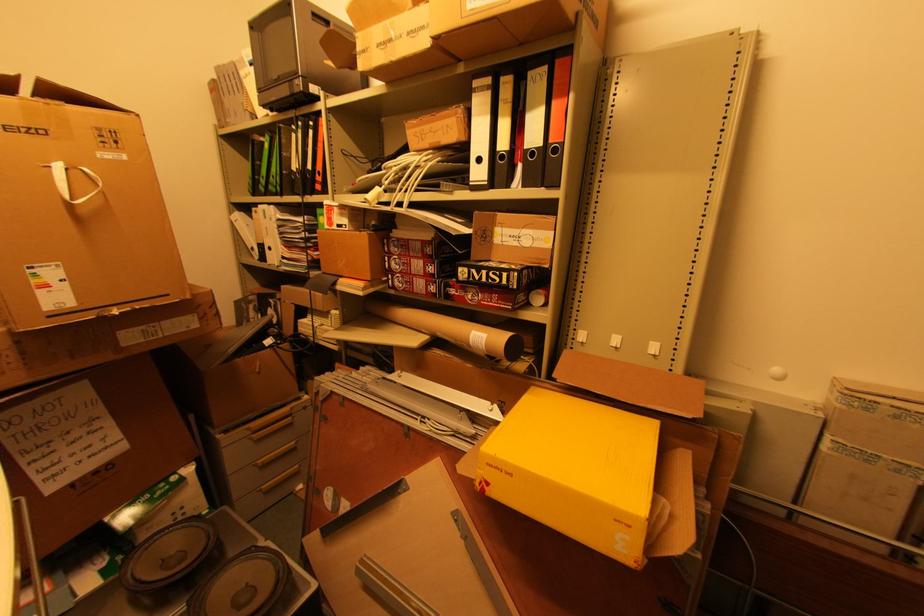
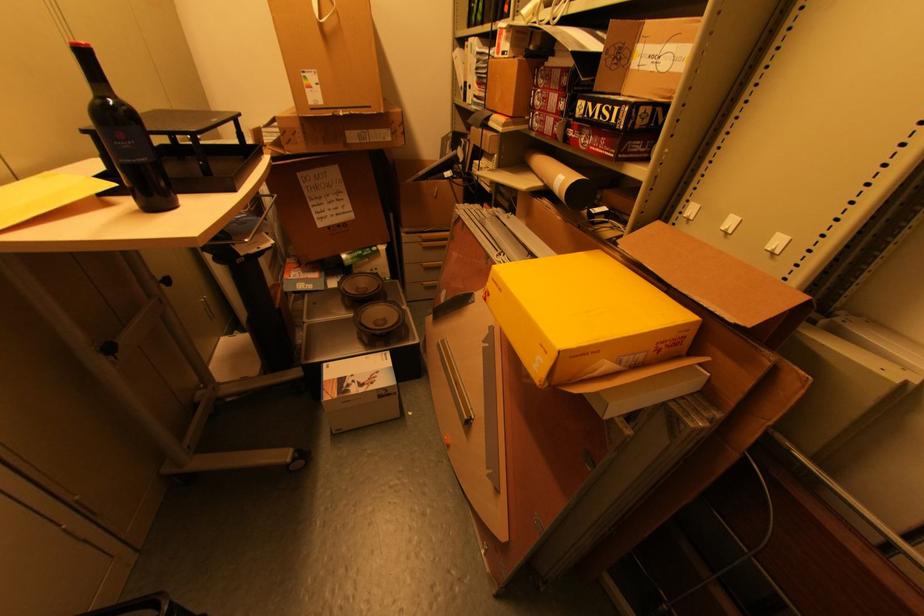
Locate, in the second image, the point that corresponds to (496,274) in the first image.

(610, 108)